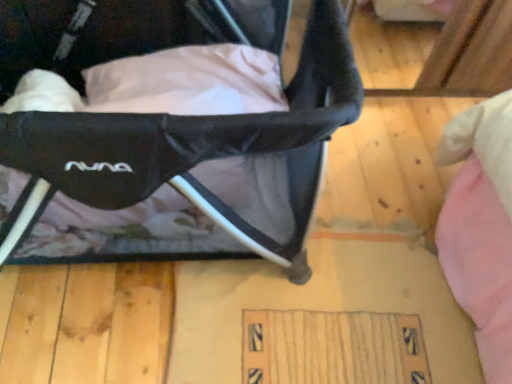
This screenshot has width=512, height=384. In order to click on black mesh crib at center in this screenshot , I will do `click(196, 147)`.

Image resolution: width=512 pixels, height=384 pixels. What do you see at coordinates (196, 147) in the screenshot?
I see `black mesh crib at center` at bounding box center [196, 147].

Locate an element on the screen. black mesh crib at center is located at coordinates coord(196,147).